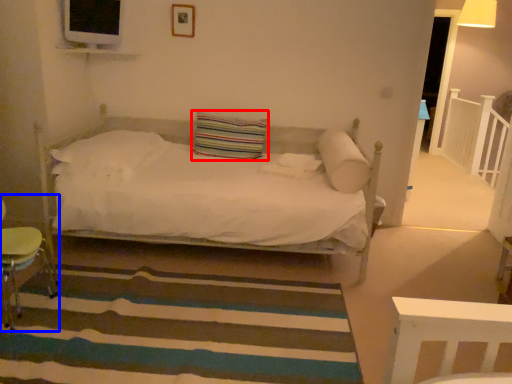
Question: Which of the following is the closest to the observer, pillow (highlighted by a red box) or swivel chair (highlighted by a blue box)?

Choices:
 (A) pillow
 (B) swivel chair

Answer: (B)